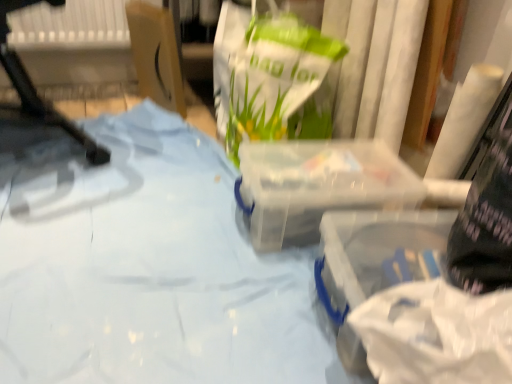
Find the location of `transparent plastic container at center, which is the first box in back-to-front order`. transparent plastic container at center, which is the first box in back-to-front order is located at coordinates (318, 186).

In order to click on blue fabric at center in this screenshot , I will do `click(147, 268)`.

Locate an element on the screen. white plastic chair at left is located at coordinates (36, 91).

Is cardboard box at upper left with transparent plastic container at lower right, marked as the second box in a back-to-front arrangement?

They are not placed beside each other.

Can you tell me how much cardboard box at upper left and transparent plastic container at lower right, marked as the second box in a back-to-front arrangement, differ in facing direction?

9.34 degrees separate the facing orientations of cardboard box at upper left and transparent plastic container at lower right, marked as the second box in a back-to-front arrangement.

Is cardboard box at upper left bigger than transparent plastic container at lower right, marked as the second box in a back-to-front arrangement?

Indeed, cardboard box at upper left has a larger size compared to transparent plastic container at lower right, marked as the second box in a back-to-front arrangement.

Is point (137, 6) positioned before point (389, 230)?

That is False.

Is cardboard box at upper left located within transparent plastic container at lower right, marked as the second box in a back-to-front arrangement?

No, cardboard box at upper left is not inside transparent plastic container at lower right, marked as the second box in a back-to-front arrangement.

Is transparent plastic container at lower right, which is counted as the first box, starting from the front, directly adjacent to cardboard box at upper left?

No, transparent plastic container at lower right, which is counted as the first box, starting from the front, is not with cardboard box at upper left.

Considering the positions of objects transparent plastic container at lower right, which is counted as the first box, starting from the front, and cardboard box at upper left in the image provided, who is behind, transparent plastic container at lower right, which is counted as the first box, starting from the front, or cardboard box at upper left?

Positioned behind is cardboard box at upper left.

From the image's perspective, which one is positioned higher, transparent plastic container at lower right, marked as the second box in a back-to-front arrangement, or cardboard box at upper left?

cardboard box at upper left is shown above in the image.

Is cardboard box at upper left oriented towards white plastic chair at left?

Yes, cardboard box at upper left is oriented towards white plastic chair at left.

Would you say cardboard box at upper left is outside white plastic chair at left?

cardboard box at upper left lies outside white plastic chair at left's area.

Considering their positions, is cardboard box at upper left located in front of or behind white plastic chair at left?

Clearly, cardboard box at upper left is behind white plastic chair at left.

Is cardboard box at upper left touching white plastic chair at left?

cardboard box at upper left is not next to white plastic chair at left, and they're not touching.

From the picture: Can you tell me how much blue fabric at center and cardboard box at upper left differ in facing direction?

The facing directions of blue fabric at center and cardboard box at upper left are 95.1 degrees apart.

Could you tell me if blue fabric at center is turned towards cardboard box at upper left?

No, blue fabric at center is not facing towards cardboard box at upper left.

Find the location of a particular element. cardboard box above the blue fabric at center (from the image's perspective) is located at coordinates (156, 54).

Can you see blue fabric at center touching cardboard box at upper left?

No.

Is white plastic chair at left bigger than transparent plastic container at lower right, marked as the second box in a back-to-front arrangement?

Correct, white plastic chair at left is larger in size than transparent plastic container at lower right, marked as the second box in a back-to-front arrangement.

Between white plastic chair at left and transparent plastic container at lower right, which is counted as the first box, starting from the front, which one is positioned in front?

transparent plastic container at lower right, which is counted as the first box, starting from the front.

Is point (2, 41) less distant than point (338, 318)?

No, (2, 41) is behind (338, 318).

Is white plastic chair at left facing towards blue fabric at center?

Yes, white plastic chair at left is turned towards blue fabric at center.

Is white plastic chair at left located outside blue fabric at center?

Yes, white plastic chair at left is outside of blue fabric at center.

What's the angular difference between white plastic chair at left and blue fabric at center's facing directions?

There is a 167-degree angle between the facing directions of white plastic chair at left and blue fabric at center.

Is white plastic chair at left smaller than blue fabric at center?

Actually, white plastic chair at left might be larger than blue fabric at center.

Is blue fabric at center turned away from transparent plastic container at lower right, marked as the second box in a back-to-front arrangement?

No, blue fabric at center is not facing the opposite direction of transparent plastic container at lower right, marked as the second box in a back-to-front arrangement.

How far apart are blue fabric at center and transparent plastic container at lower right, marked as the second box in a back-to-front arrangement?

blue fabric at center is 11.04 inches from transparent plastic container at lower right, marked as the second box in a back-to-front arrangement.

Considering the relative positions of blue fabric at center and transparent plastic container at lower right, which is counted as the first box, starting from the front, in the image provided, is blue fabric at center to the left of transparent plastic container at lower right, which is counted as the first box, starting from the front, from the viewer's perspective?

Correct, you'll find blue fabric at center to the left of transparent plastic container at lower right, which is counted as the first box, starting from the front.

Considering the relative positions of blue fabric at center and transparent plastic container at lower right, which is counted as the first box, starting from the front, in the image provided, is blue fabric at center behind transparent plastic container at lower right, which is counted as the first box, starting from the front,?

Yes.

Starting from the cardboard box at upper left, which box is the 2nd one to the right? Please provide its 2D coordinates.

[(375, 263)]

You are a GUI agent. You are given a task and a screenshot of the screen. Output one action in this format:
    pyautogui.click(x=<x>, y=<y>)
    Task: Click on the 2nd box in front of the cardboard box at upper left, starting your count from the anchor
    The height and width of the screenshot is (384, 512).
    Given the screenshot: What is the action you would take?
    pyautogui.click(x=375, y=263)

Which object lies further to the anchor point transparent plastic container at center, arranged as the 2th box when viewed from the front, blue fabric at center or cardboard box at upper left?

The object further to transparent plastic container at center, arranged as the 2th box when viewed from the front, is cardboard box at upper left.

When comparing their distances from white plastic chair at left, does transparent plastic container at center, which is the first box in back-to-front order, or cardboard box at upper left seem further?

The object further to white plastic chair at left is transparent plastic container at center, which is the first box in back-to-front order.

Estimate the real-world distances between objects in this image. Which object is further from white plastic chair at left, blue fabric at center or transparent plastic container at center, arranged as the 2th box when viewed from the front?

The object further to white plastic chair at left is transparent plastic container at center, arranged as the 2th box when viewed from the front.

When comparing their distances from transparent plastic container at center, which is the first box in back-to-front order, does white plastic chair at left or cardboard box at upper left seem further?

white plastic chair at left is further to transparent plastic container at center, which is the first box in back-to-front order.

From the image, which object appears to be nearer to blue fabric at center, cardboard box at upper left or white plastic chair at left?

white plastic chair at left is closer to blue fabric at center.

Based on the photo, estimate the real-world distances between objects in this image. Which object is closer to transparent plastic container at lower right, which is counted as the first box, starting from the front, blue fabric at center or cardboard box at upper left?

blue fabric at center is closer to transparent plastic container at lower right, which is counted as the first box, starting from the front.

Based on their spatial positions, is white plastic chair at left or transparent plastic container at lower right, marked as the second box in a back-to-front arrangement, closer to cardboard box at upper left?

white plastic chair at left is closer to cardboard box at upper left.

When comparing their distances from white plastic chair at left, does transparent plastic container at center, arranged as the 2th box when viewed from the front, or blue fabric at center seem further?

transparent plastic container at center, arranged as the 2th box when viewed from the front, lies further to white plastic chair at left than the other object.

Where is `furniture positioned between blue fabric at center and cardboard box at upper left from near to far`? This screenshot has width=512, height=384. furniture positioned between blue fabric at center and cardboard box at upper left from near to far is located at coordinates coord(36,91).

Identify the location of sheet situated between white plastic chair at left and transparent plastic container at center, which is the first box in back-to-front order, from left to right. (147, 268).

Identify the location of sheet located between white plastic chair at left and transparent plastic container at lower right, which is counted as the first box, starting from the front, in the left-right direction. (147, 268).

Locate an element on the screen. This screenshot has width=512, height=384. cardboard box between white plastic chair at left and transparent plastic container at center, which is the first box in back-to-front order is located at coordinates (156, 54).